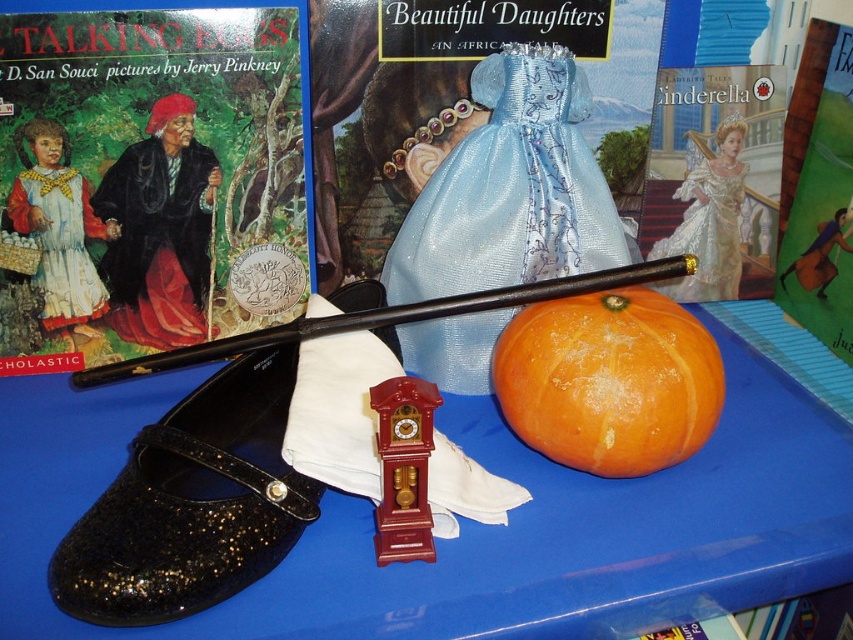
Is point (558, 193) in front of point (579, 429)?

No, it is not.

Is shiny blue dress at center shorter than orange matte pumpkin at center?

No, shiny blue dress at center is not shorter than orange matte pumpkin at center.

I want to click on shiny blue dress at center, so (511, 188).

Is the position of velvet black doll at upper left more distant than that of matte blue dress at center?

That is False.

Can you confirm if velvet black doll at upper left is bigger than matte blue dress at center?

Correct, velvet black doll at upper left is larger in size than matte blue dress at center.

Between point (120, 241) and point (840, 172), which one is positioned behind?

The point (840, 172) is more distant.

Image resolution: width=853 pixels, height=640 pixels. In order to click on velvet black doll at upper left in this screenshot , I will do `click(160, 230)`.

Who is shorter, blue glossy table at center or matte black book at left?

Standing shorter between the two is blue glossy table at center.

Does blue glossy table at center appear on the right side of matte black book at left?

Yes, blue glossy table at center is to the right of matte black book at left.

Is point (822, 454) more distant than point (143, 250)?

No.

The width and height of the screenshot is (853, 640). What are the coordinates of `blue glossy table at center` in the screenshot? It's located at (471, 524).